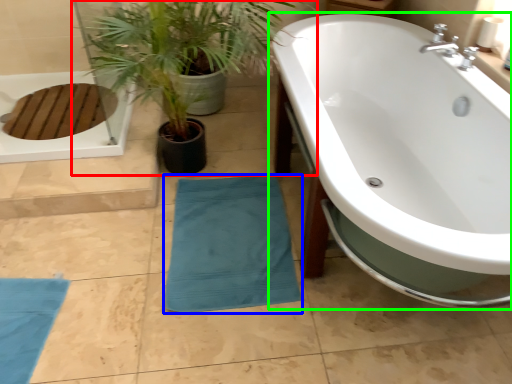
Question: Which object is positioned farthest from houseplant (highlighted by a red box)? Select from beach towel (highlighted by a blue box) and bathtub (highlighted by a green box).

Choices:
 (A) beach towel
 (B) bathtub

Answer: (A)